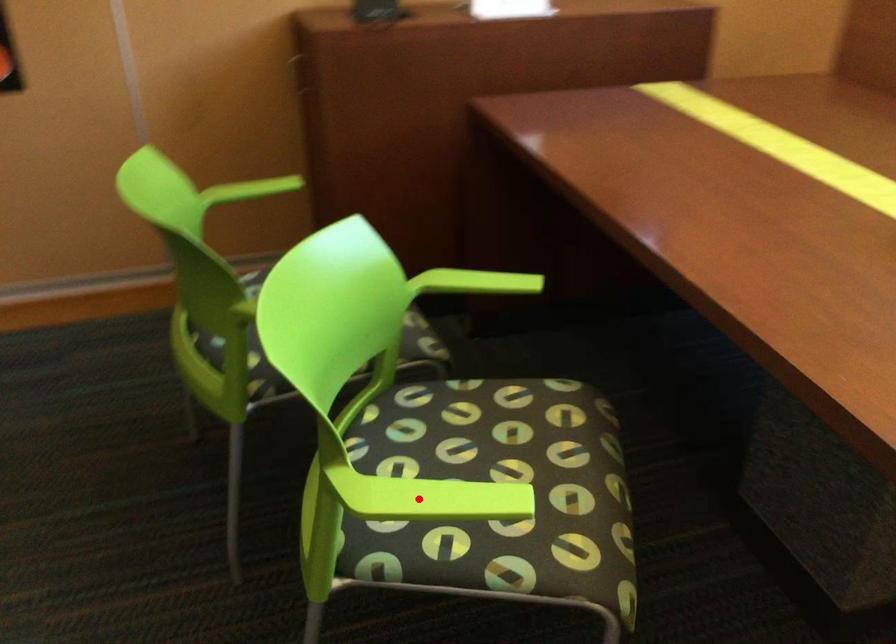
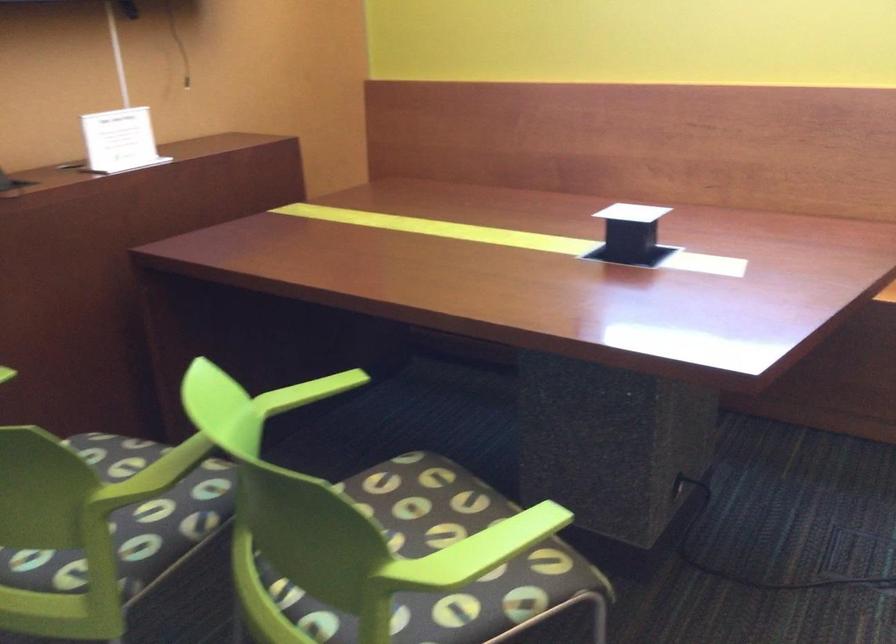
The point at the highlighted location is marked in the first image. Where is the corresponding point in the second image?

(476, 552)